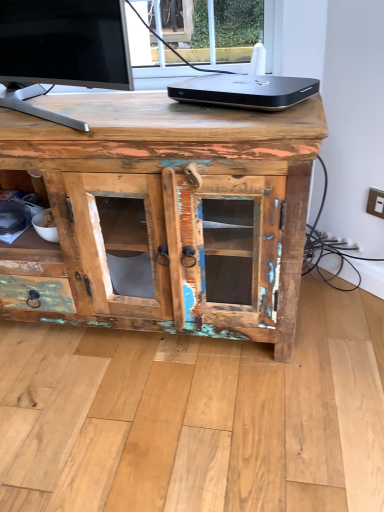
Question: Is black metallic device at upper center far away from metallic beige switch at upper right?

Choices:
 (A) no
 (B) yes

Answer: (A)

Question: Is black metallic device at upper center to the left of metallic beige switch at upper right from the viewer's perspective?

Choices:
 (A) yes
 (B) no

Answer: (A)

Question: Does black metallic device at upper center have a smaller size compared to metallic beige switch at upper right?

Choices:
 (A) no
 (B) yes

Answer: (A)

Question: Considering the relative sizes of black metallic device at upper center and metallic beige switch at upper right in the image provided, is black metallic device at upper center thinner than metallic beige switch at upper right?

Choices:
 (A) yes
 (B) no

Answer: (B)

Question: Considering the relative sizes of black metallic device at upper center and metallic beige switch at upper right in the image provided, is black metallic device at upper center taller than metallic beige switch at upper right?

Choices:
 (A) no
 (B) yes

Answer: (A)

Question: From a real-world perspective, is black metallic device at upper center positioned over metallic beige switch at upper right based on gravity?

Choices:
 (A) yes
 (B) no

Answer: (A)

Question: From a real-world perspective, is metallic beige switch at upper right below rustic wood cabinet at center?

Choices:
 (A) no
 (B) yes

Answer: (B)

Question: Is metallic beige switch at upper right thinner than rustic wood cabinet at center?

Choices:
 (A) yes
 (B) no

Answer: (A)

Question: Is rustic wood cabinet at center at the back of metallic beige switch at upper right?

Choices:
 (A) yes
 (B) no

Answer: (B)

Question: From the image's perspective, is metallic beige switch at upper right located above rustic wood cabinet at center?

Choices:
 (A) yes
 (B) no

Answer: (A)

Question: From the image's perspective, would you say metallic beige switch at upper right is shown under rustic wood cabinet at center?

Choices:
 (A) yes
 (B) no

Answer: (B)

Question: Does metallic beige switch at upper right turn towards rustic wood cabinet at center?

Choices:
 (A) yes
 (B) no

Answer: (A)

Question: Considering the relative sizes of black metallic device at upper center and rustic wood cabinet at center in the image provided, is black metallic device at upper center bigger than rustic wood cabinet at center?

Choices:
 (A) yes
 (B) no

Answer: (B)